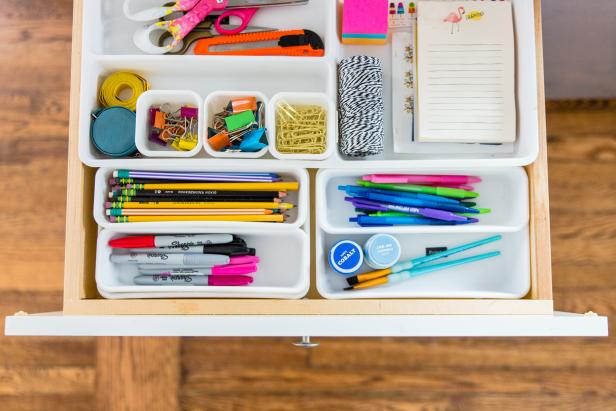
Image resolution: width=616 pixels, height=411 pixels. What are the coordinates of `paper pads` in the screenshot? It's located at (365, 21), (398, 54), (411, 41), (432, 28).